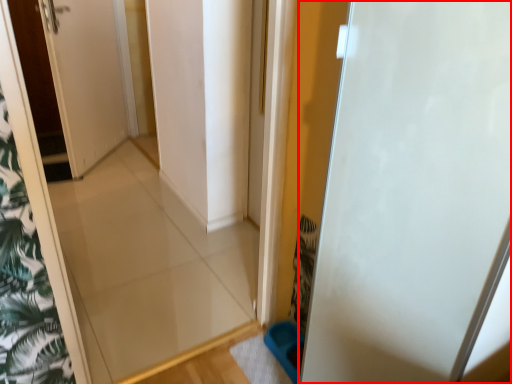
Question: From the image's perspective, where is door (annotated by the red box) located in relation to door in the image?

Choices:
 (A) below
 (B) above

Answer: (A)